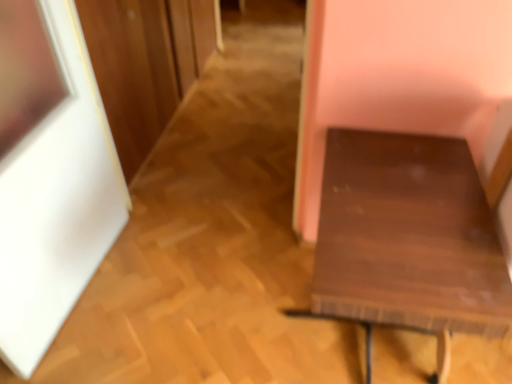
Identify the location of free spot below dark wood table at right (from a real-world perspective). (344, 342).